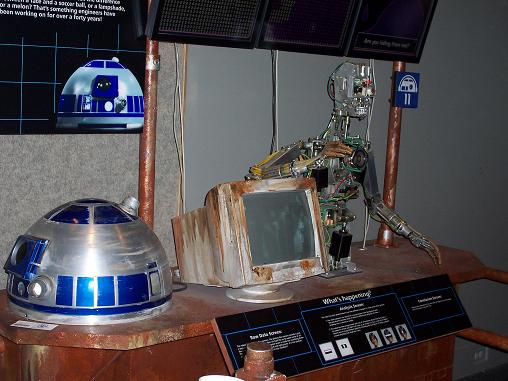
I want to click on display plaque, so click(326, 321).